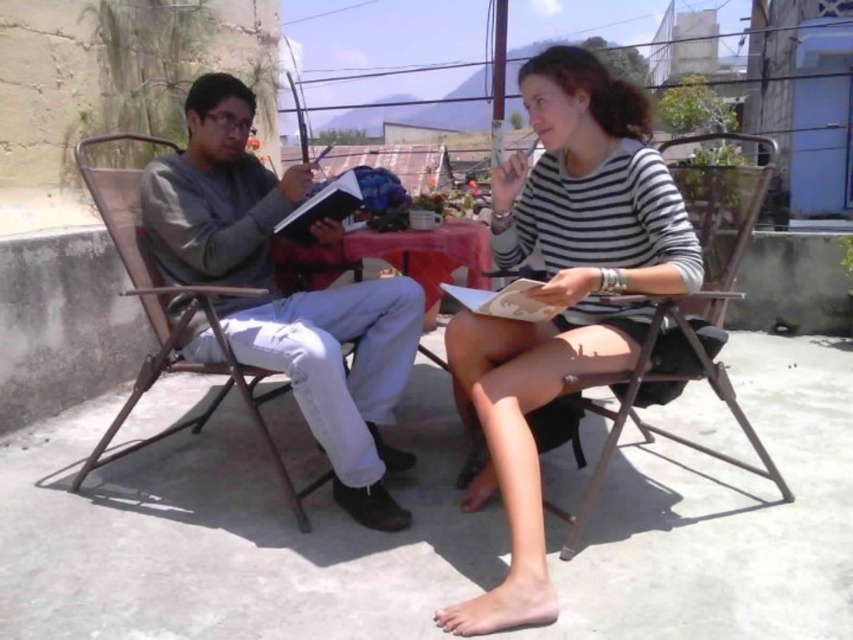
Question: Which of the following is the closest to the observer?

Choices:
 (A) (698, 180)
 (B) (538, 593)

Answer: (B)

Question: From the image, what is the correct spatial relationship of white striped shirt at center in relation to metallic silver chair at center?

Choices:
 (A) right
 (B) left

Answer: (B)

Question: Is matte gray sweater at upper left above white striped shirt at center?

Choices:
 (A) yes
 (B) no

Answer: (B)

Question: Which object is farther from the camera taking this photo?

Choices:
 (A) white striped shirt at center
 (B) matte gray sweater at upper left
 (C) metallic silver chair at center
 (D) light gray sweater at left

Answer: (D)

Question: Among these objects, which one is nearest to the camera?

Choices:
 (A) matte gray sweater at upper left
 (B) light gray sweater at left

Answer: (A)

Question: Can you confirm if matte gray sweater at upper left is wider than light gray sweater at left?

Choices:
 (A) no
 (B) yes

Answer: (A)